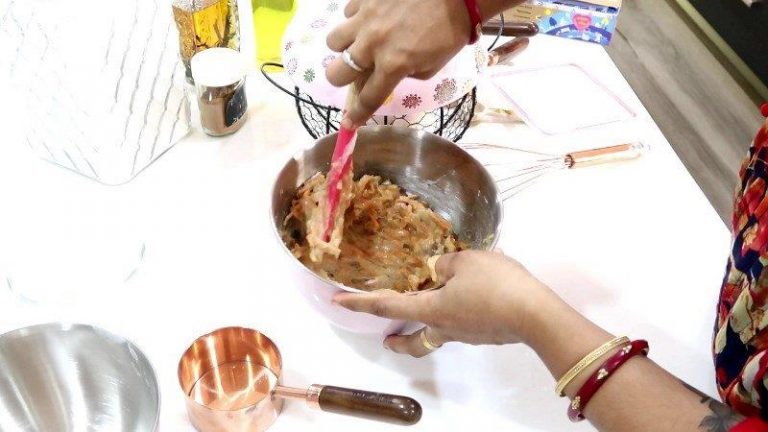
Where is `metallic mixing bowls`? The height and width of the screenshot is (432, 768). metallic mixing bowls is located at coordinates [x=124, y=366], [x=458, y=176].